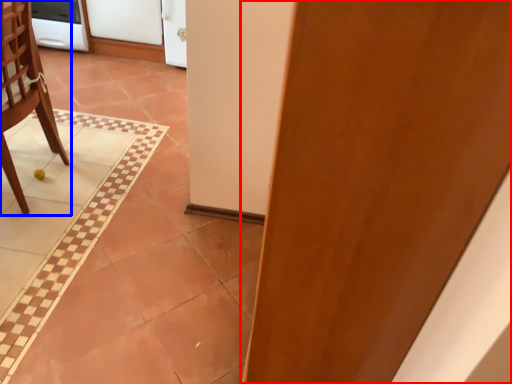
Question: Which object is closer to the camera taking this photo, door (highlighted by a red box) or chair (highlighted by a blue box)?

Choices:
 (A) door
 (B) chair

Answer: (A)